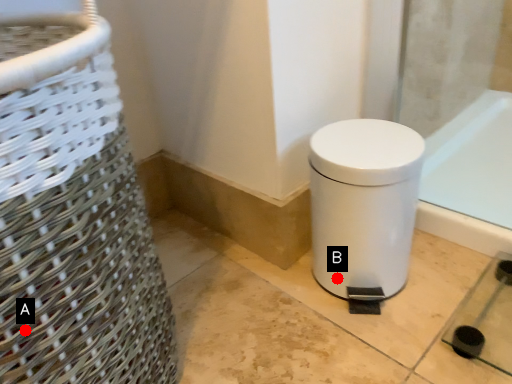
Question: Two points are circled on the image, labeled by A and B beside each circle. Which of the following is the closest to the observer?

Choices:
 (A) A is closer
 (B) B is closer

Answer: (A)